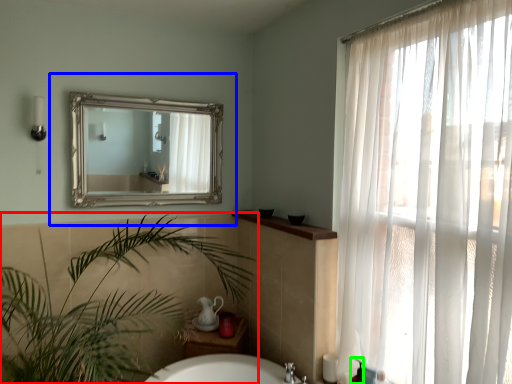
Question: Estimate the real-world distances between objects in this image. Which object is closer to houseplant (highlighted by a red box), medicine cabinet (highlighted by a blue box) or toiletry (highlighted by a green box)?

Choices:
 (A) medicine cabinet
 (B) toiletry

Answer: (A)